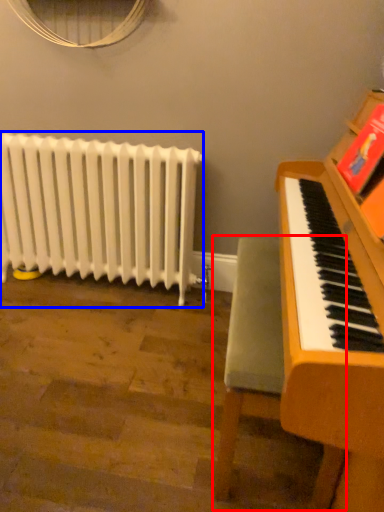
Question: Which object is closer to the camera taking this photo, armchair (highlighted by a red box) or radiator (highlighted by a blue box)?

Choices:
 (A) armchair
 (B) radiator

Answer: (A)